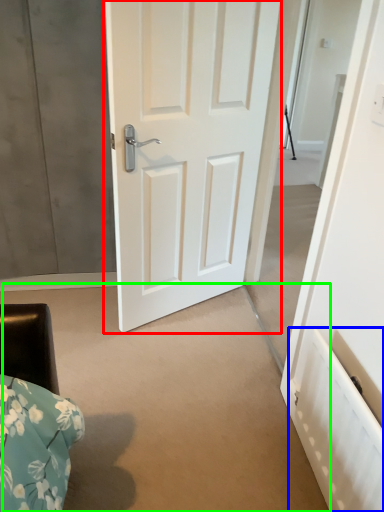
Question: Which object is the closest to the door (highlighted by a red box)? Choose among these: radiator (highlighted by a blue box) or concrete (highlighted by a green box).

Choices:
 (A) radiator
 (B) concrete

Answer: (B)